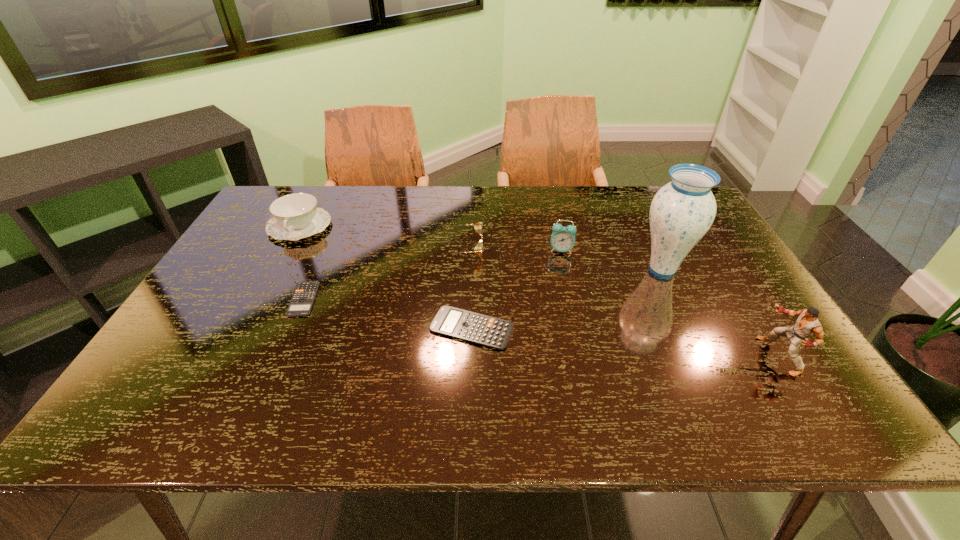
This screenshot has height=540, width=960. I want to click on vacant space at the left edge, so click(x=250, y=316).

Identify the location of vacant space at the right edge of the desktop. The width and height of the screenshot is (960, 540). (705, 295).

I want to click on vacant region at the far right corner of the desktop, so click(656, 187).

Where is `unoccupied area between the right calculator and the puncher`? unoccupied area between the right calculator and the puncher is located at coordinates (625, 342).

The image size is (960, 540). What are the coordinates of `vacant space that's between the right calculator and the sixth shortest object` in the screenshot? It's located at (625, 342).

At what (x,y) coordinates should I click in order to perform the action: click on unoccupied position between the left calculator and the chinaware. Please return your answer as a coordinate pair (x, y). Image resolution: width=960 pixels, height=540 pixels. Looking at the image, I should click on (301, 263).

Where is `vacant space in between the sixth object from left to right and the second shortest object`? This screenshot has height=540, width=960. vacant space in between the sixth object from left to right and the second shortest object is located at coordinates (566, 299).

Find the location of a particular element. The width and height of the screenshot is (960, 540). empty location between the third shortest object and the third tallest object is located at coordinates (512, 250).

Where is `free space between the third shortest object and the sixth tallest object`? free space between the third shortest object and the sixth tallest object is located at coordinates (467, 289).

Locate an element on the screen. This screenshot has height=540, width=960. blank region between the chinaware and the fifth object from left to right is located at coordinates (430, 238).